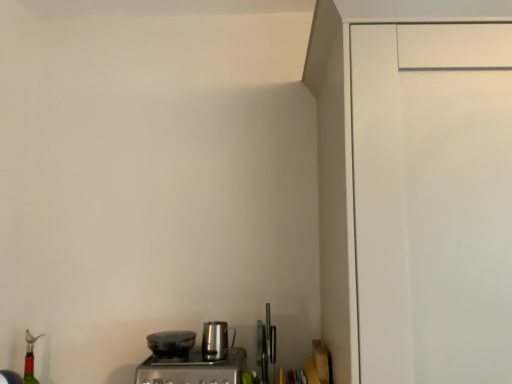
Question: Is stainless steel coffee maker at lower center positioned beyond the bounds of translucent red glass bottle at lower left?

Choices:
 (A) yes
 (B) no

Answer: (A)

Question: Is stainless steel coffee maker at lower center facing away from translucent red glass bottle at lower left?

Choices:
 (A) no
 (B) yes

Answer: (A)

Question: Does stainless steel coffee maker at lower center have a smaller size compared to translucent red glass bottle at lower left?

Choices:
 (A) no
 (B) yes

Answer: (A)

Question: From the image's perspective, would you say stainless steel coffee maker at lower center is shown under translucent red glass bottle at lower left?

Choices:
 (A) no
 (B) yes

Answer: (A)

Question: Does stainless steel coffee maker at lower center lie in front of translucent red glass bottle at lower left?

Choices:
 (A) yes
 (B) no

Answer: (A)

Question: In the image, is translucent red glass bottle at lower left positioned in front of or behind stainless steel kettle at center, which appears as the first kitchen appliance when viewed from the right?

Choices:
 (A) behind
 (B) front

Answer: (A)

Question: Does point (34, 337) appear closer or farther from the camera than point (214, 352)?

Choices:
 (A) closer
 (B) farther

Answer: (B)

Question: Based on their sizes in the image, would you say translucent red glass bottle at lower left is bigger or smaller than stainless steel kettle at center, arranged as the 2th kitchen appliance when viewed from the left?

Choices:
 (A) small
 (B) big

Answer: (B)

Question: From the image's perspective, is translucent red glass bottle at lower left above or below stainless steel kettle at center, arranged as the 2th kitchen appliance when viewed from the left?

Choices:
 (A) above
 (B) below

Answer: (B)

Question: From the image's perspective, is shiny black pot at lower center, the 2th kitchen appliance in the right-to-left sequence, located above or below translucent red glass bottle at lower left?

Choices:
 (A) below
 (B) above

Answer: (B)

Question: Looking at the image, does shiny black pot at lower center, the 2th kitchen appliance in the right-to-left sequence, seem bigger or smaller compared to translucent red glass bottle at lower left?

Choices:
 (A) small
 (B) big

Answer: (A)

Question: In terms of width, does shiny black pot at lower center, the 2th kitchen appliance in the right-to-left sequence, look wider or thinner when compared to translucent red glass bottle at lower left?

Choices:
 (A) wide
 (B) thin

Answer: (A)

Question: Is point (166, 354) closer or farther from the camera than point (25, 359)?

Choices:
 (A) closer
 (B) farther

Answer: (A)

Question: Is shiny black pot at lower center, placed as the first kitchen appliance when sorted from left to right, wider or thinner than stainless steel kettle at center, arranged as the 2th kitchen appliance when viewed from the left?

Choices:
 (A) wide
 (B) thin

Answer: (A)

Question: From the image's perspective, is shiny black pot at lower center, the 2th kitchen appliance in the right-to-left sequence, located above or below stainless steel kettle at center, arranged as the 2th kitchen appliance when viewed from the left?

Choices:
 (A) above
 (B) below

Answer: (B)